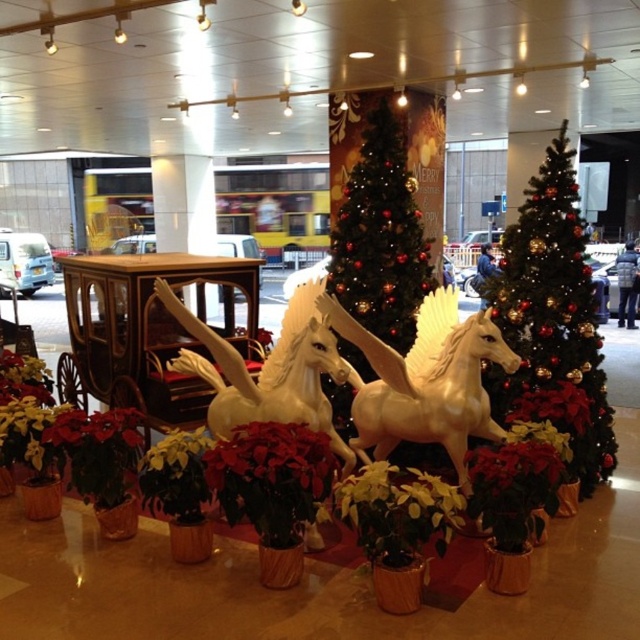
Question: Based on their relative distances, which object is farther from the green glossy christmas tree at center?

Choices:
 (A) shiny gold christmas tree at center
 (B) red velvet poinsettia at center
 (C) wooden cart at center
 (D) white glossy horse at center

Answer: (C)

Question: Which point appears closest to the camera in this image?

Choices:
 (A) (467, 477)
 (B) (288, 474)

Answer: (B)

Question: Which point is closer to the camera?

Choices:
 (A) wooden coach at center
 (B) green glossy christmas tree at center

Answer: (B)

Question: Is wooden cart at center below white glossy horse at center?

Choices:
 (A) no
 (B) yes

Answer: (A)

Question: Is gold glossy horse at center wider than wooden coach at center?

Choices:
 (A) yes
 (B) no

Answer: (A)

Question: Can you confirm if wooden cart at center is wider than white glossy horse at center?

Choices:
 (A) no
 (B) yes

Answer: (B)